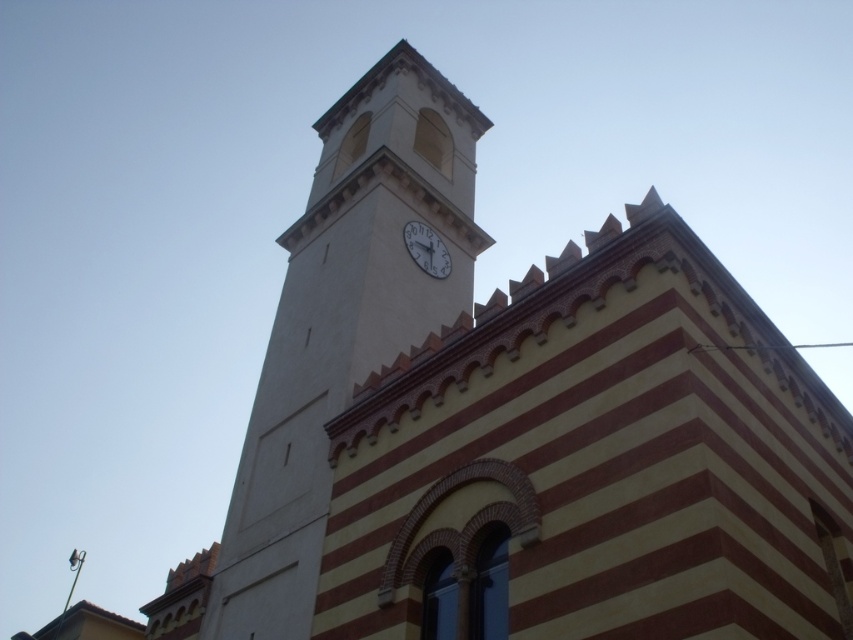
Question: Is white smooth clock tower at upper center further to camera compared to white glossy clock at center?

Choices:
 (A) no
 (B) yes

Answer: (A)

Question: Does white smooth clock tower at upper center come behind white glossy clock at center?

Choices:
 (A) no
 (B) yes

Answer: (A)

Question: Which of the following is the farthest from the observer?

Choices:
 (A) white smooth clock tower at upper center
 (B) white glossy clock at center

Answer: (B)

Question: Can you confirm if white smooth clock tower at upper center is smaller than white glossy clock at center?

Choices:
 (A) no
 (B) yes

Answer: (A)